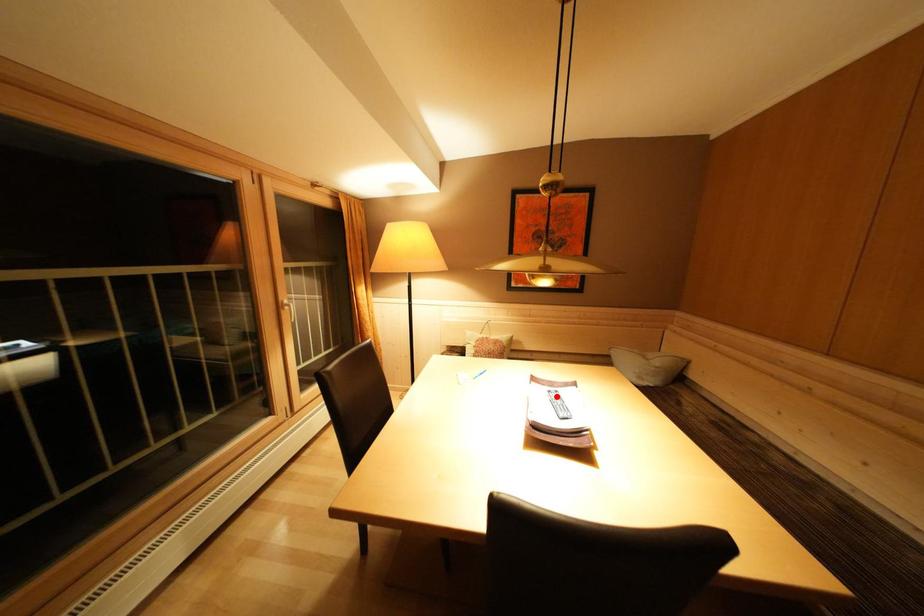
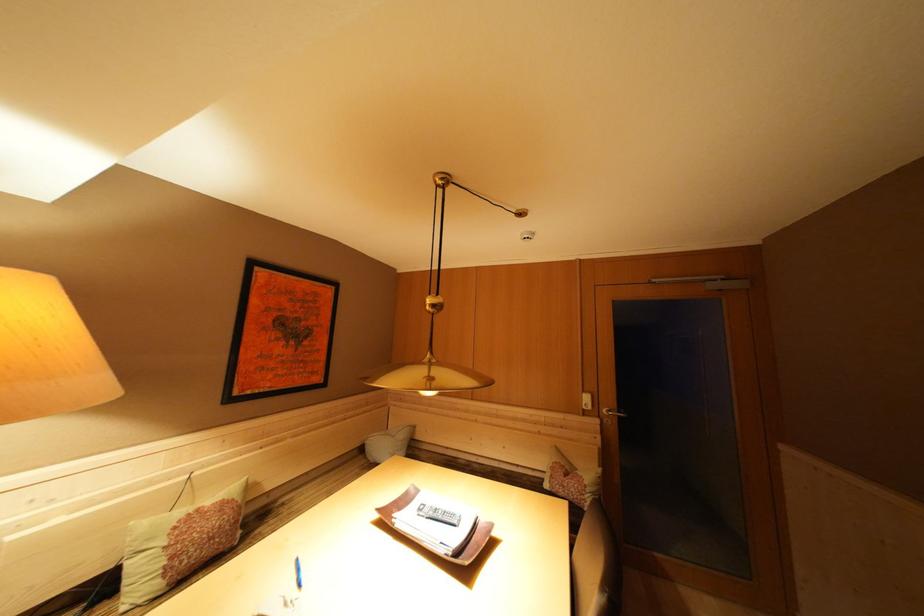
Where in the second image is the point corresponding to the highlighted location from the first image?

(427, 515)